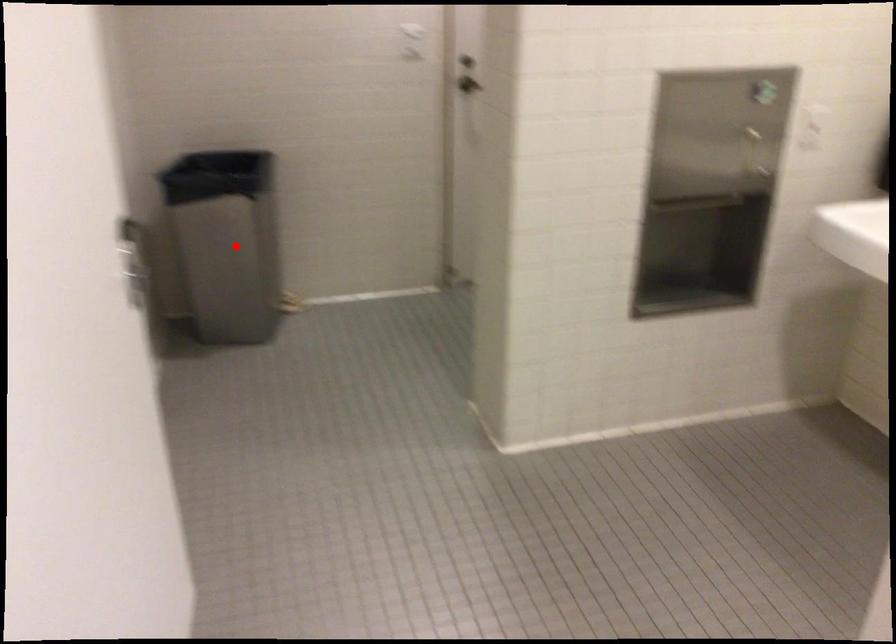
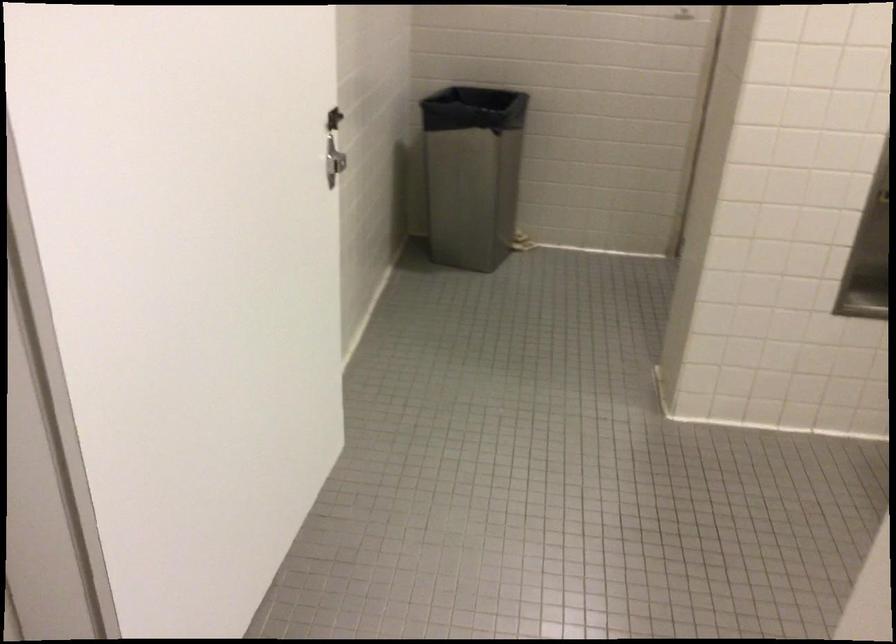
The point at the highlighted location is marked in the first image. Where is the corresponding point in the second image?

(471, 173)